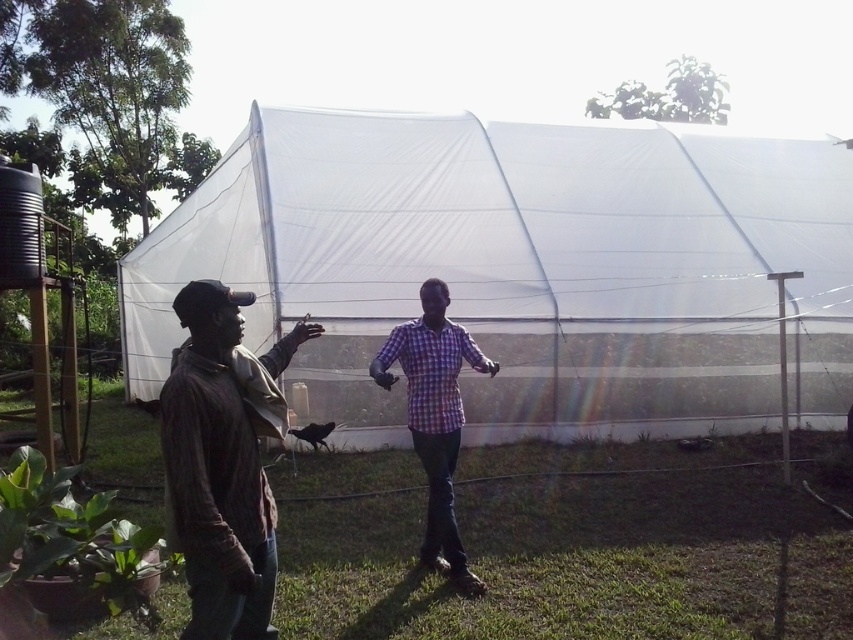
Question: Which of the following is the farthest from the observer?

Choices:
 (A) checkered fabric shirt at center
 (B) brown corduroy jacket at center

Answer: (A)

Question: Does transparent plastic tent at center have a larger size compared to checkered fabric shirt at center?

Choices:
 (A) yes
 (B) no

Answer: (A)

Question: Does brown corduroy jacket at center appear over checkered fabric shirt at center?

Choices:
 (A) yes
 (B) no

Answer: (A)

Question: Based on their relative distances, which object is farther from the transparent plastic tent at center?

Choices:
 (A) checkered fabric shirt at center
 (B) brown corduroy jacket at center

Answer: (B)

Question: Estimate the real-world distances between objects in this image. Which object is farther from the transparent plastic tent at center?

Choices:
 (A) brown corduroy jacket at center
 (B) checkered fabric shirt at center

Answer: (A)

Question: Considering the relative positions of transparent plastic tent at center and checkered fabric shirt at center in the image provided, where is transparent plastic tent at center located with respect to checkered fabric shirt at center?

Choices:
 (A) right
 (B) left

Answer: (A)